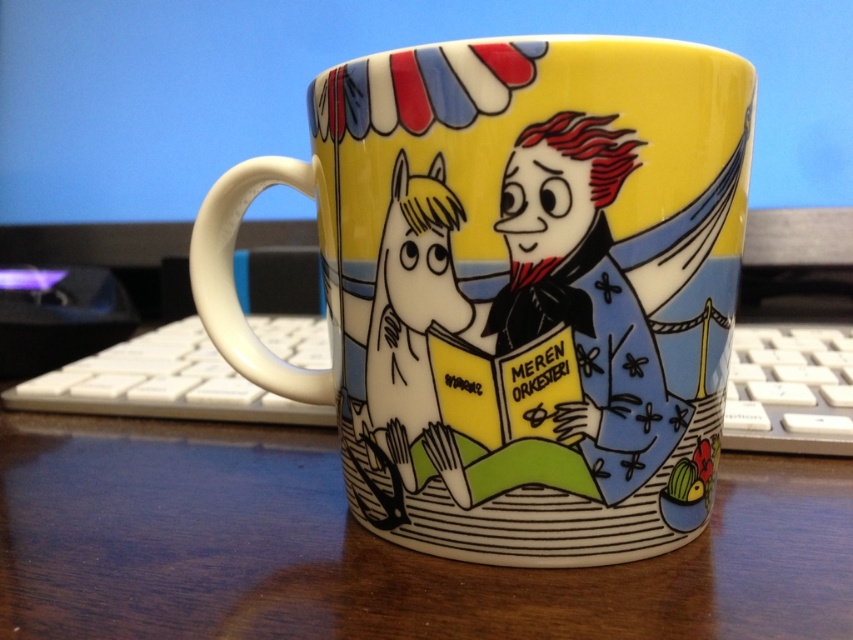
You are a student who just arrived at the desk. You need to place your notebook on the wooden table at center. Where should you place it so it doesn not get in the way of the white plastic keyboard at lower left?

The wooden table at center is positioned under the white plastic keyboard at lower left, so placing the notebook on the table away from the area directly under the keyboard would prevent it from obstructing the keyboard.

You are organizing a desk and need to place a new item between the glossy ceramic mug at center and the white plastic keyboard at lower left. Which object should you move to make space?

The glossy ceramic mug at center occupies less space than the white plastic keyboard at lower left, so you should move the white plastic keyboard at lower left to make more space for the new item.